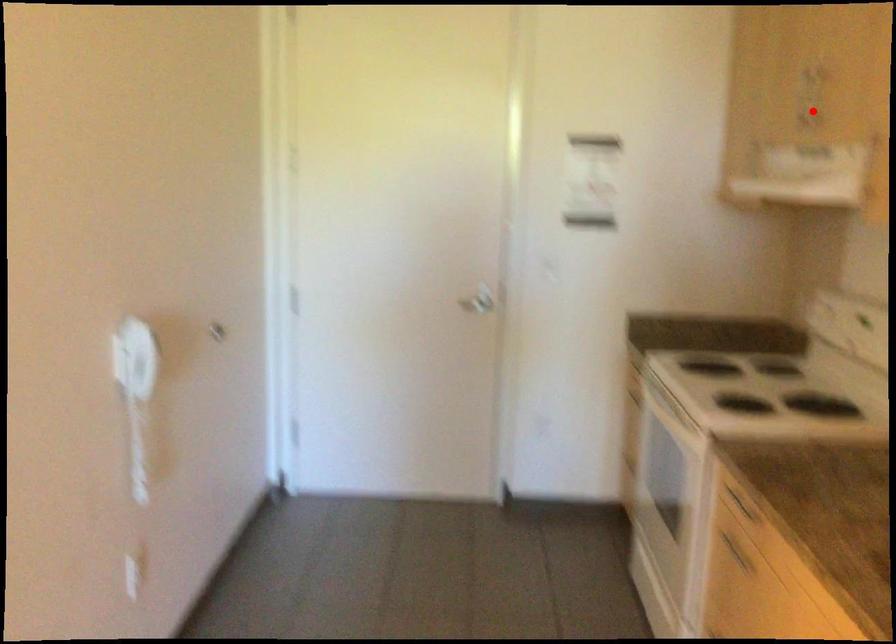
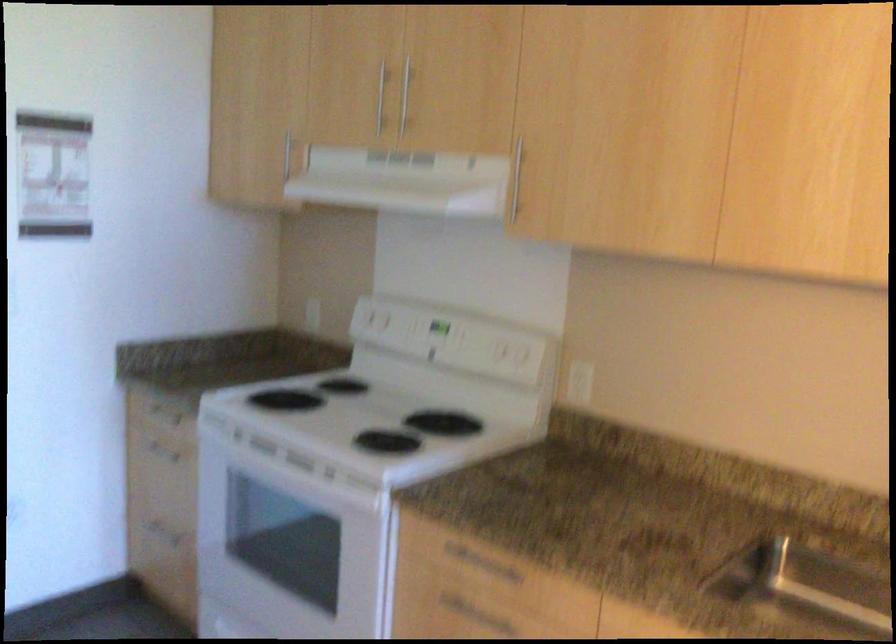
Find the pixel in the second image that matches the highlighted location in the first image.

(380, 98)